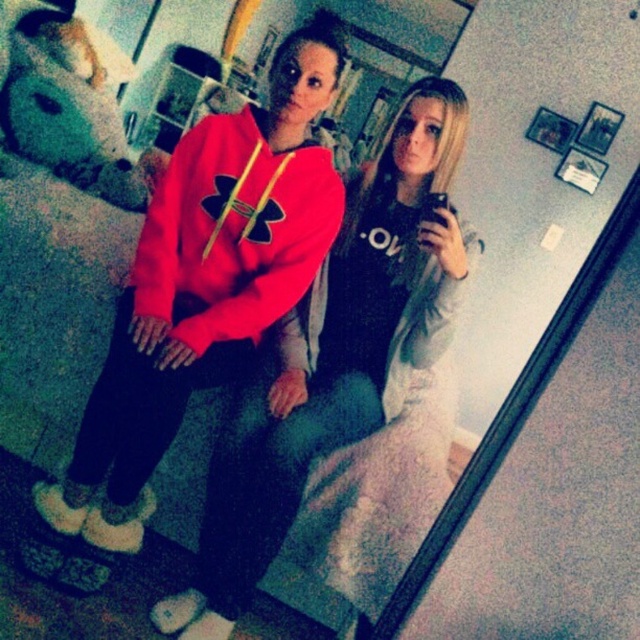
You are trying to decide which hoodie to wear today. Both the matte fleece hoodie at center and the matte red hoodie at center are in front of you. Which one is on the left side?

The matte fleece hoodie at center is positioned on the left side of the matte red hoodie at center.